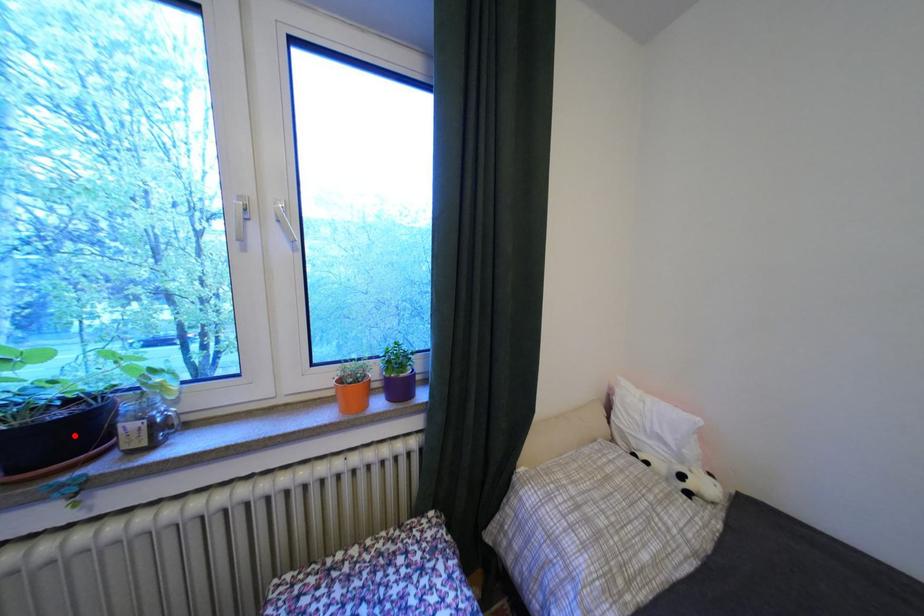
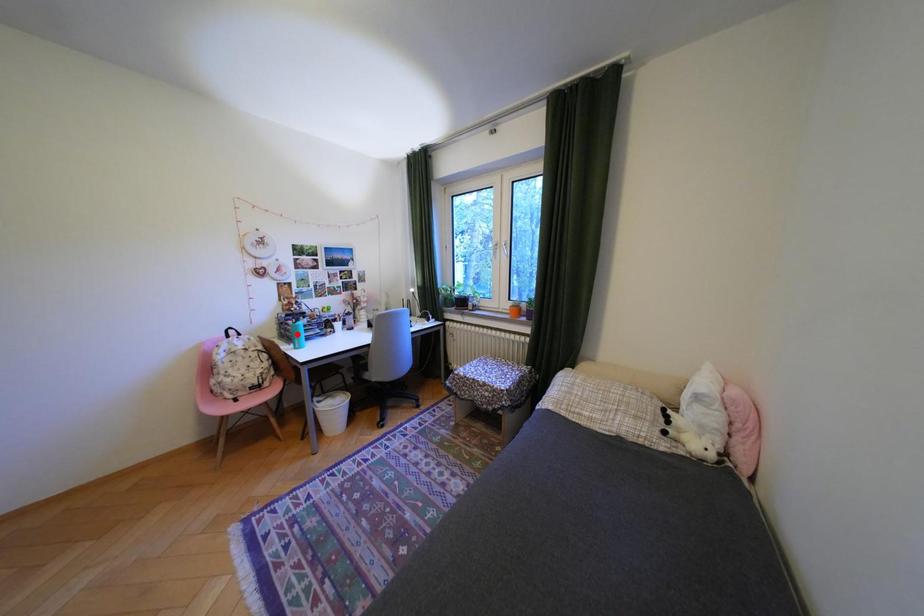
I am providing you with two images of the same scene from different viewpoints. A red point is marked on the first image and another point is marked on the second image. Is the marked point in image1 the same physical position as the marked point in image2?

No